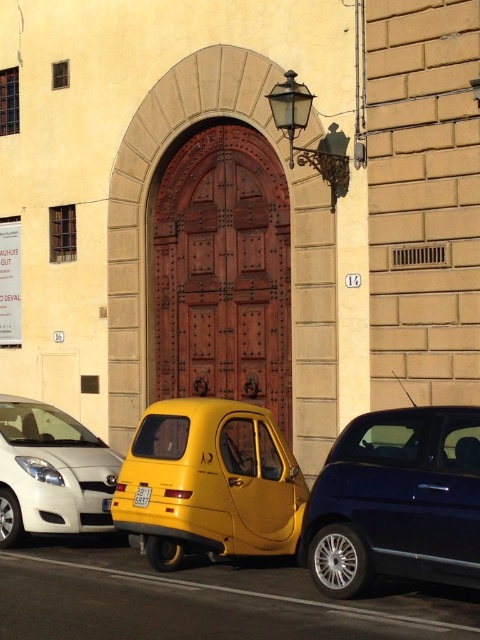
Question: Does yellow plastic license plate at center appear over yellow matte license plate at center?

Choices:
 (A) no
 (B) yes

Answer: (B)

Question: Which object is farther from the camera taking this photo?

Choices:
 (A) yellow plastic license plate at center
 (B) shiny blue car at right

Answer: (A)

Question: Based on their relative distances, which object is farther from the shiny blue car at right?

Choices:
 (A) yellow matte taxi at center
 (B) white glossy car at lower left
 (C) yellow matte license plate at center
 (D) yellow plastic license plate at center

Answer: (B)

Question: Is shiny blue car at right closer to camera compared to white glossy car at lower left?

Choices:
 (A) yes
 (B) no

Answer: (A)

Question: Which of these objects is positioned farthest from the shiny blue car at right?

Choices:
 (A) yellow plastic license plate at center
 (B) white glossy car at lower left
 (C) yellow matte license plate at center

Answer: (B)

Question: In this image, where is yellow plastic license plate at center located relative to yellow matte license plate at center?

Choices:
 (A) left
 (B) right

Answer: (B)